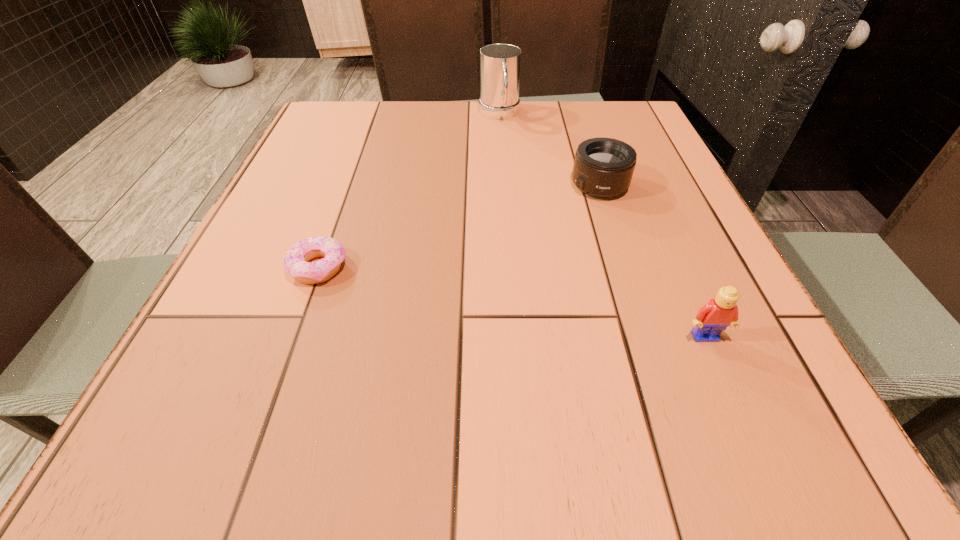
Locate an element on the screen. The height and width of the screenshot is (540, 960). doughnut is located at coordinates (295, 263).

At what (x,y) coordinates should I click in order to perform the action: click on the leftmost object. Please return your answer as a coordinate pair (x, y). The width and height of the screenshot is (960, 540). Looking at the image, I should click on (295, 263).

Locate an element on the screen. the nearest object is located at coordinates (719, 313).

Where is `the second tallest object`? This screenshot has width=960, height=540. the second tallest object is located at coordinates (719, 313).

Find the location of a particular element. The width and height of the screenshot is (960, 540). the third nearest object is located at coordinates (603, 167).

You are a GUI agent. You are given a task and a screenshot of the screen. Output one action in this format:
    pyautogui.click(x=<x>, y=<y>)
    Task: Click on the third tallest object
    
    Given the screenshot: What is the action you would take?
    tap(603, 167)

This screenshot has width=960, height=540. What are the coordinates of `mug` in the screenshot? It's located at (500, 64).

Locate an element on the screen. The image size is (960, 540). the tallest object is located at coordinates [x=500, y=64].

The height and width of the screenshot is (540, 960). Identify the location of vacant space situated 0.140m on the right of the doughnut. (422, 267).

Where is `free space located on the side of the third nearest object with brand markings and control switches`? The width and height of the screenshot is (960, 540). free space located on the side of the third nearest object with brand markings and control switches is located at coordinates (483, 266).